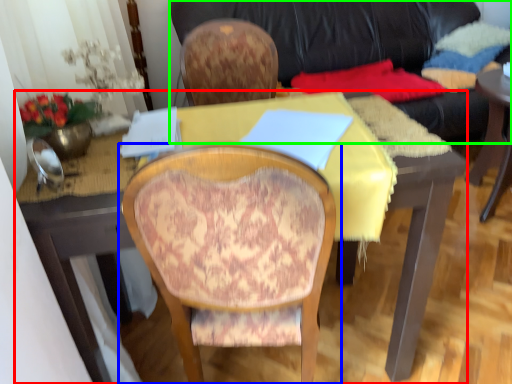
Question: Estimate the real-world distances between objects in this image. Which object is farther from desk (highlighted by a red box), chair (highlighted by a blue box) or studio couch (highlighted by a green box)?

Choices:
 (A) chair
 (B) studio couch

Answer: (B)